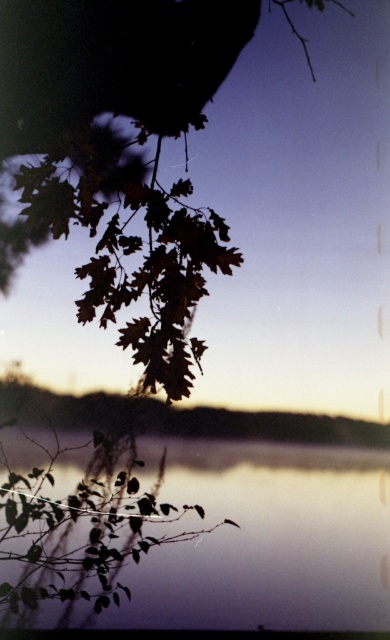
Question: Which object appears farthest from the camera in this image?

Choices:
 (A) brown leafy branch at upper left
 (B) silvery reflective water at bottom center

Answer: (A)

Question: Observing the image, what is the correct spatial positioning of brown leafy branch at upper left in reference to silvery reflective water at bottom center?

Choices:
 (A) below
 (B) above

Answer: (B)

Question: Is brown leafy branch at upper left above silvery reflective water at bottom center?

Choices:
 (A) no
 (B) yes

Answer: (B)

Question: Can you confirm if brown leafy branch at upper left is positioned below silvery reflective water at bottom center?

Choices:
 (A) no
 (B) yes

Answer: (A)

Question: Which point is farther from the camera taking this photo?

Choices:
 (A) (335, 573)
 (B) (76, 189)

Answer: (B)

Question: Which point is closer to the camera?

Choices:
 (A) (101, 136)
 (B) (161, 618)

Answer: (B)